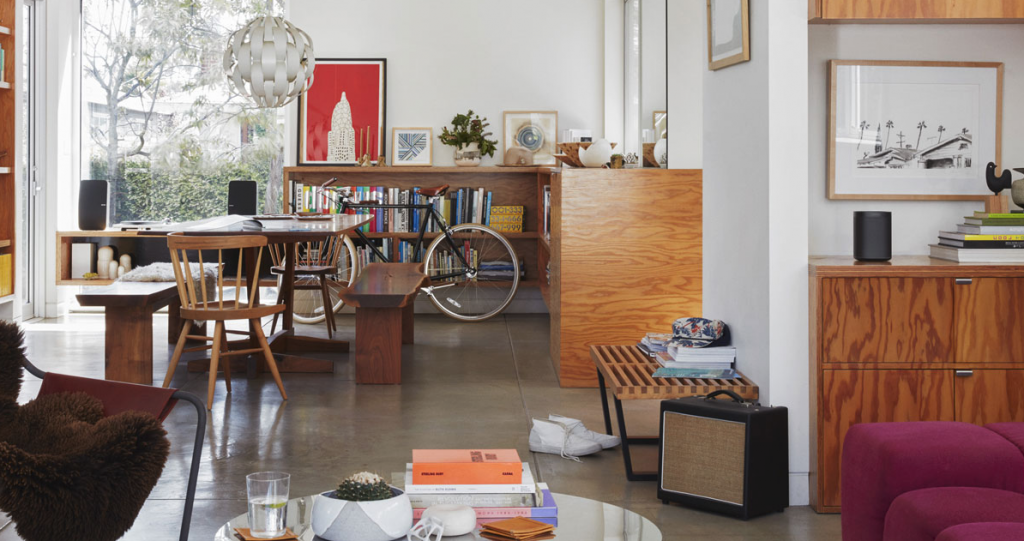
You are a GUI agent. You are given a task and a screenshot of the screen. Output one action in this format:
    pyautogui.click(x=<x>, y=<y>)
    Task: Click on the books
    
    Given the screenshot: What is the action you would take?
    pyautogui.click(x=459, y=474)